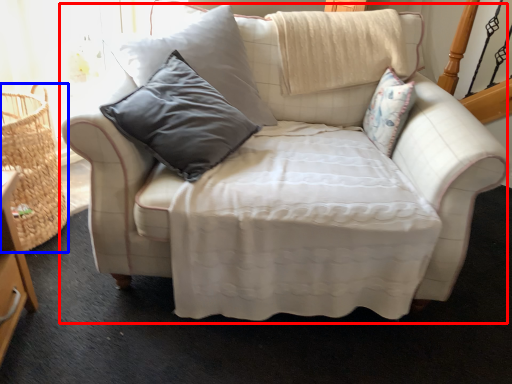
Question: Which point is further to the camera, studio couch (highlighted by a red box) or basket (highlighted by a blue box)?

Choices:
 (A) studio couch
 (B) basket

Answer: (B)